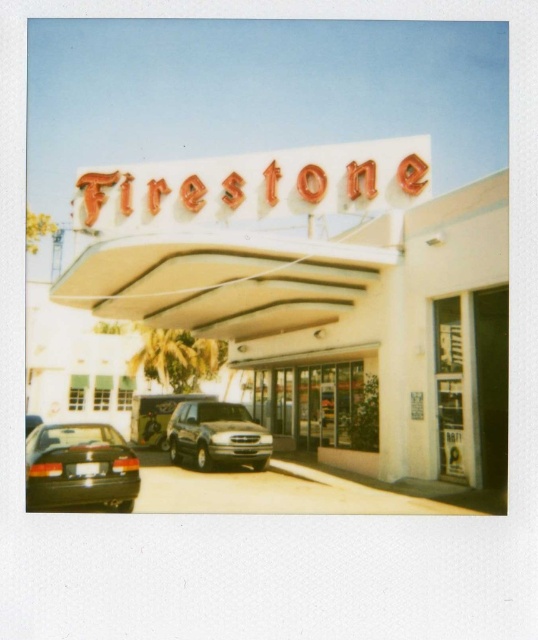
Question: Does white matte sign at upper center have a smaller size compared to shiny black sedan at lower left?

Choices:
 (A) yes
 (B) no

Answer: (B)

Question: Estimate the real-world distances between objects in this image. Which object is farther from the orange metallic sign at upper center?

Choices:
 (A) white matte sign at upper center
 (B) dark gray metallic suv at center
 (C) black matte car at lower left
 (D) shiny black sedan at lower left

Answer: (D)

Question: Does white matte sign at upper center appear over black matte car at lower left?

Choices:
 (A) yes
 (B) no

Answer: (A)

Question: Which object is positioned closest to the shiny black sedan at lower left?

Choices:
 (A) dark gray metallic suv at center
 (B) white matte sign at upper center
 (C) orange metallic sign at upper center
 (D) black matte car at lower left

Answer: (A)

Question: Among these objects, which one is nearest to the camera?

Choices:
 (A) white matte sign at upper center
 (B) dark gray metallic suv at center
 (C) shiny black sedan at lower left

Answer: (C)

Question: Is orange metallic sign at upper center behind shiny black sedan at lower left?

Choices:
 (A) yes
 (B) no

Answer: (A)